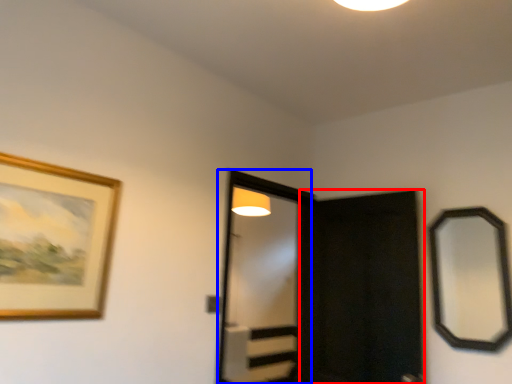
Question: Among these objects, which one is farthest to the camera, screen door (highlighted by a red box) or screen door (highlighted by a blue box)?

Choices:
 (A) screen door
 (B) screen door

Answer: (B)